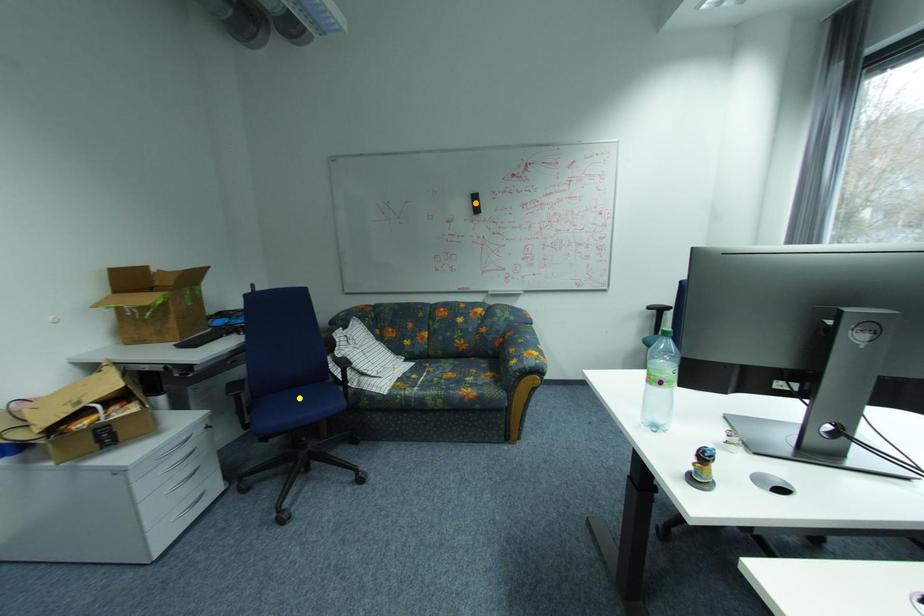
Order these from nearest to farthest:
orange point
purple point
yellow point

purple point, yellow point, orange point